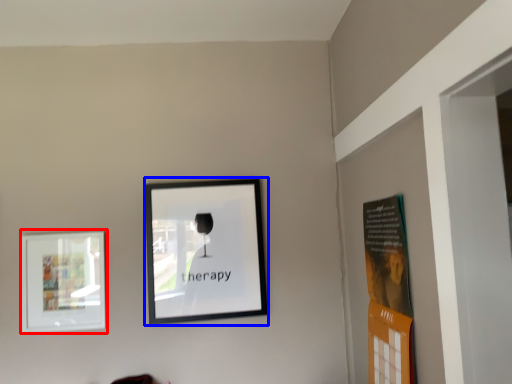
Question: Which object appears closest to the camera in this image, picture frame (highlighted by a red box) or picture frame (highlighted by a blue box)?

Choices:
 (A) picture frame
 (B) picture frame

Answer: (A)